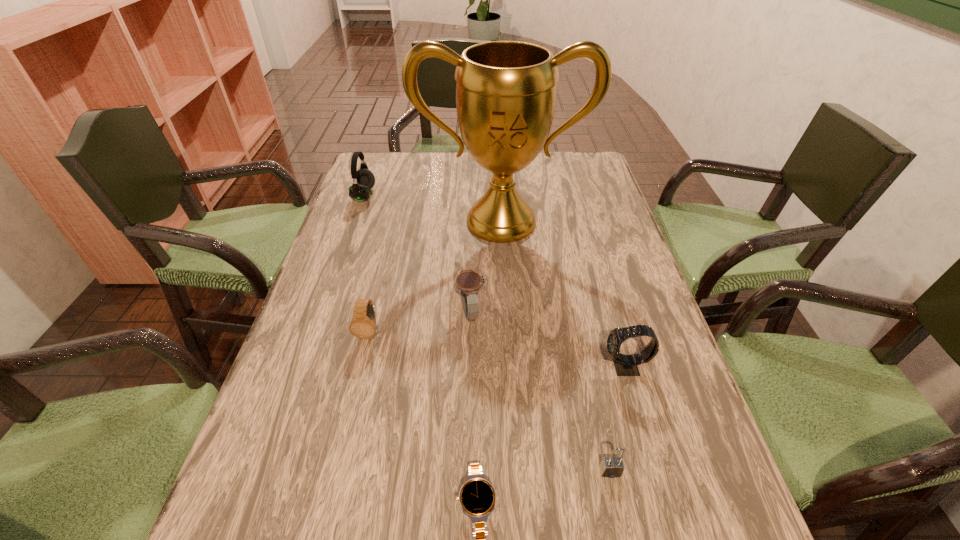
You are a GUI agent. You are given a task and a screenshot of the screen. Output one action in this format:
    pyautogui.click(x=<x>, y=<y>)
    Task: Click on the vacant space at the left edge
    Image resolution: width=960 pixels, height=540 pixels.
    Given the screenshot: What is the action you would take?
    pyautogui.click(x=330, y=416)

In the image, there is a desktop. Find the location of `free space at the right edge`. free space at the right edge is located at coordinates (681, 433).

Where is `free region at the far right corner of the desktop`? free region at the far right corner of the desktop is located at coordinates (590, 179).

At what (x,y) coordinates should I click in order to perform the action: click on vacant space that's between the tallest object and the sixth object from right to left. Please return your answer as a coordinate pair (x, y). Image resolution: width=960 pixels, height=540 pixels. Looking at the image, I should click on (435, 277).

This screenshot has height=540, width=960. Identify the location of vacant area that lies between the second tallest object and the second shortest object. (488, 333).

Find the location of a particular element. vacant point located between the padlock and the trophy cup is located at coordinates (556, 346).

Identify the location of free area in between the leftmost watch and the second tallest object. (367, 264).

The height and width of the screenshot is (540, 960). I want to click on vacant space that's between the padlock and the trophy cup, so click(556, 346).

Where is `empty space that is in between the leftmost watch and the headset`? The height and width of the screenshot is (540, 960). empty space that is in between the leftmost watch and the headset is located at coordinates (367, 264).

At what (x,y) coordinates should I click in order to perform the action: click on vacant space that is in between the third nearest object and the leftmost watch. Please return your answer as a coordinate pair (x, y). Looking at the image, I should click on (497, 350).